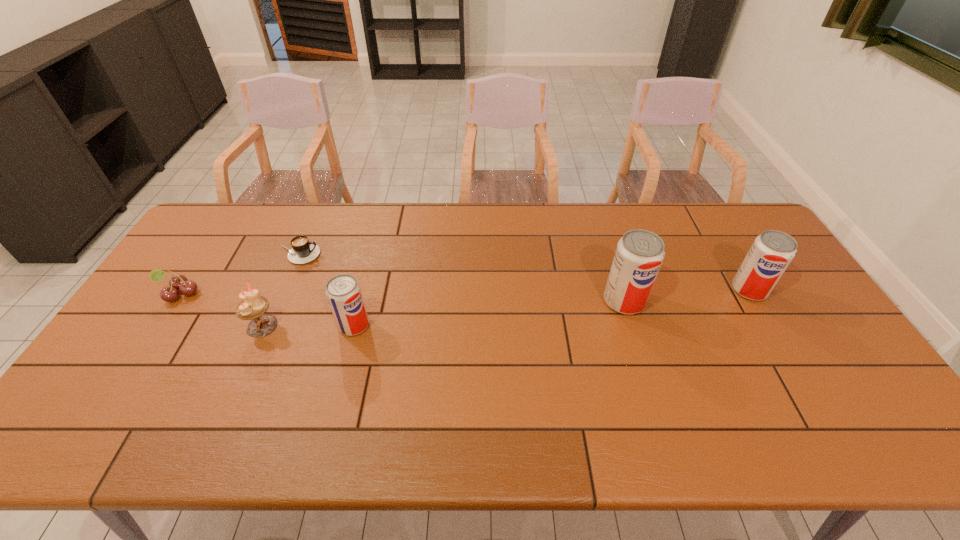
Where is `free spot between the fourth object from left to right and the second soda from left to right`? free spot between the fourth object from left to right and the second soda from left to right is located at coordinates (489, 313).

Image resolution: width=960 pixels, height=540 pixels. What are the coordinates of `free spot between the leftmost object and the candle holder` in the screenshot? It's located at (221, 310).

Where is `free space between the cherry and the fifth object from left to right`? This screenshot has height=540, width=960. free space between the cherry and the fifth object from left to right is located at coordinates (402, 298).

Point out which object is positioned as the fifth nearest to the shortest object. Please provide its 2D coordinates. Your answer should be formatted as a tuple, i.e. [(x, y)], where the tuple contains the x and y coordinates of a point satisfying the conditions above.

[(771, 253)]

Find the location of a particular element. object that ranks as the second closest to the fifth tallest object is located at coordinates (252, 306).

Where is `soda that is the second closest one to the rightmost object`? The height and width of the screenshot is (540, 960). soda that is the second closest one to the rightmost object is located at coordinates (343, 291).

Identify which soda is the third nearest to the candle holder. Please provide its 2D coordinates. Your answer should be formatted as a tuple, i.e. [(x, y)], where the tuple contains the x and y coordinates of a point satisfying the conditions above.

[(771, 253)]

The height and width of the screenshot is (540, 960). In order to click on free space that satisfies the following two spatial constraints: 1. on the back side of the rightmost object; 2. on the right side of the fifth object from left to right in this screenshot , I will do `click(620, 290)`.

Where is `free location that satisfies the following two spatial constraints: 1. on the back side of the third object from right to left; 2. with the handle on the side of the cappuccino`? free location that satisfies the following two spatial constraints: 1. on the back side of the third object from right to left; 2. with the handle on the side of the cappuccino is located at coordinates (372, 254).

Identify the location of free space that satisfies the following two spatial constraints: 1. with the handle on the side of the shortest object; 2. on the left side of the fifth object from left to right. (278, 301).